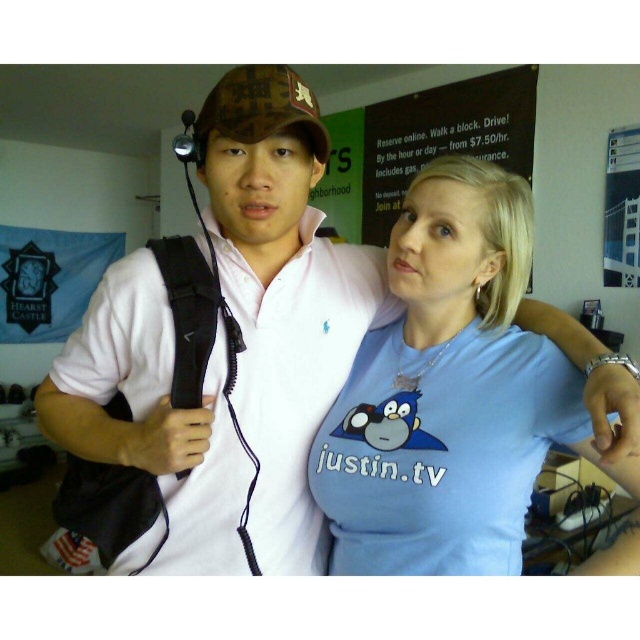
Is blue cotton t-shirt at center wider than camouflage fabric baseball cap at upper center?

Yes.

Who is positioned more to the right, blue cotton t-shirt at center or camouflage fabric baseball cap at upper center?

From the viewer's perspective, blue cotton t-shirt at center appears more on the right side.

Between point (499, 291) and point (195, 141), which one is positioned in front?

Positioned in front is point (195, 141).

Where is `blue cotton t-shirt at center`? The image size is (640, 640). blue cotton t-shirt at center is located at coordinates (449, 394).

Is black matte signboard at upper center above camouflage fabric baseball cap at upper center?

Yes.

Between black matte signboard at upper center and camouflage fabric baseball cap at upper center, which one is positioned higher?

Positioned higher is black matte signboard at upper center.

Is point (387, 221) farther from camera compared to point (310, 147)?

Yes, point (387, 221) is behind point (310, 147).

Identify the location of black matte signboard at upper center. (444, 136).

Which is more to the right, blue cotton t-shirt at center or black matte signboard at upper center?

black matte signboard at upper center

Which of these two, blue cotton t-shirt at center or black matte signboard at upper center, stands shorter?

blue cotton t-shirt at center

Who is more forward, (x=417, y=509) or (x=504, y=161)?

Point (x=417, y=509) is more forward.

Locate an element on the screen. blue cotton t-shirt at center is located at coordinates (449, 394).